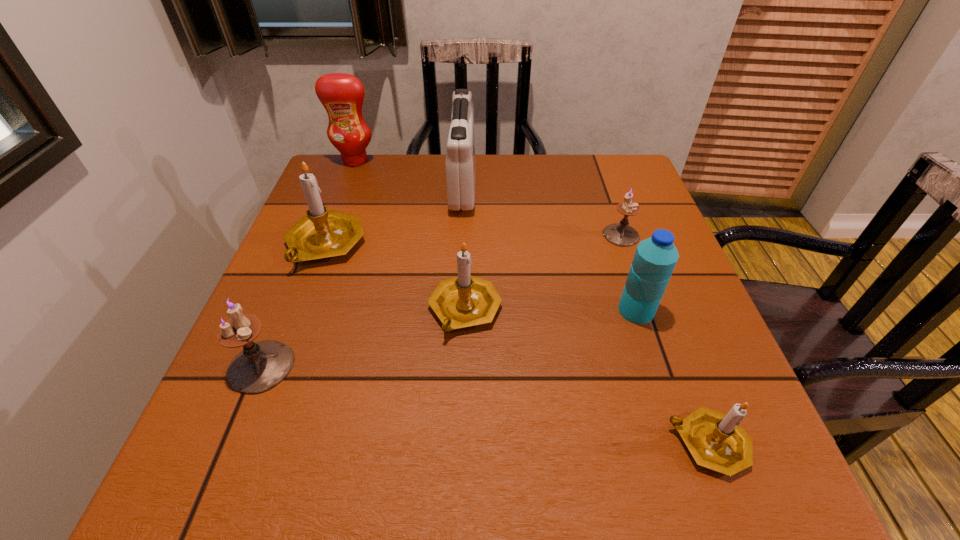
You are a GUI agent. You are given a task and a screenshot of the screen. Output one action in this format:
    pyautogui.click(x=<x>, y=<y>)
    Task: Click on the farther purple candle holder
    This screenshot has height=540, width=960.
    Given the screenshot: What is the action you would take?
    pyautogui.click(x=621, y=234)

This screenshot has width=960, height=540. Identify the location of the nearest object. (716, 440).

Locate an element on the screen. Image resolution: width=960 pixels, height=540 pixels. the rightmost gold candle holder is located at coordinates (716, 440).

Where is `vacant space situated 0.280m on the label side of the red condiment`? vacant space situated 0.280m on the label side of the red condiment is located at coordinates (328, 232).

The height and width of the screenshot is (540, 960). I want to click on vacant space located on the front side of the red first-aid kit, so click(x=509, y=185).

You are a GUI agent. You are given a task and a screenshot of the screen. Output one action in this format:
    pyautogui.click(x=<x>, y=<y>)
    Task: Click on the free space located 0.070m on the right of the tallest candle holder
    The width and height of the screenshot is (960, 540).
    Given the screenshot: What is the action you would take?
    pyautogui.click(x=396, y=245)

At what (x,y) coordinates should I click in order to perform the action: click on free space located on the front of the water bottle. Please return your answer as a coordinate pair (x, y). Image resolution: width=960 pixels, height=540 pixels. Looking at the image, I should click on (665, 400).

Where is `vacant space located 0.220m on the left of the second biggest gold candle holder`? The width and height of the screenshot is (960, 540). vacant space located 0.220m on the left of the second biggest gold candle holder is located at coordinates (317, 310).

You are a GUI agent. You are given a task and a screenshot of the screen. Output one action in this format:
    pyautogui.click(x=<x>, y=<y>)
    Task: Click on the vacant space located on the right of the nearer purple candle holder
    The height and width of the screenshot is (540, 960).
    Given the screenshot: What is the action you would take?
    pyautogui.click(x=508, y=366)

You are a GUI agent. You are given a task and a screenshot of the screen. Output one action in this format:
    pyautogui.click(x=<x>, y=<y>)
    Task: Click on the vacant space located 0.170m on the front of the right purple candle holder
    
    Given the screenshot: What is the action you would take?
    pyautogui.click(x=645, y=302)